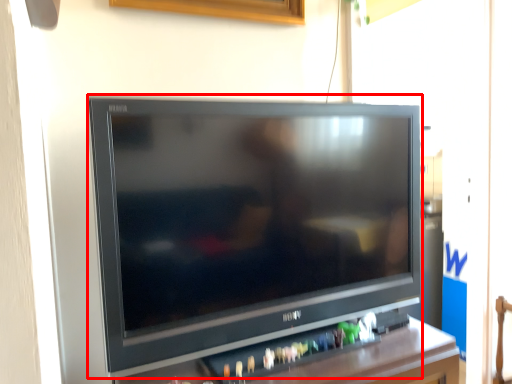
Question: From the image, what is the correct spatial relationship of television (annotated by the red box) in relation to furniture?

Choices:
 (A) left
 (B) right

Answer: (B)